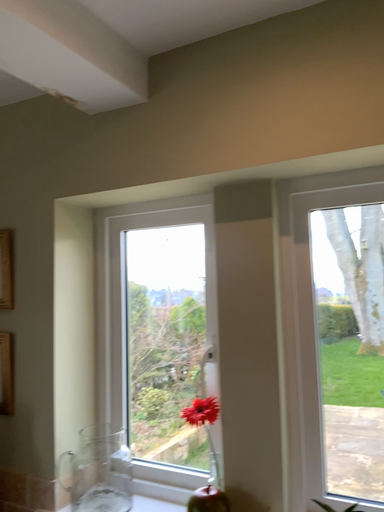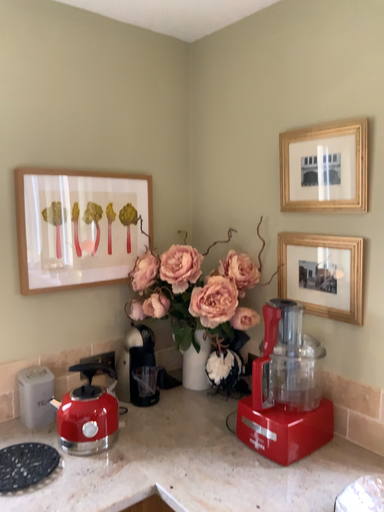
Question: How did the camera likely rotate when shooting the video?

Choices:
 (A) rotated downward
 (B) rotated upward

Answer: (A)